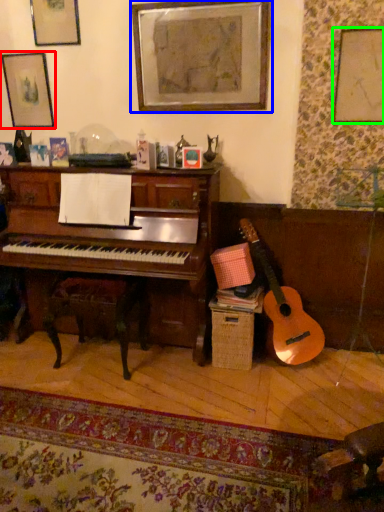
Question: Based on their relative distances, which object is nearer to picture frame (highlighted by a red box)? Choose from picture frame (highlighted by a blue box) and picture frame (highlighted by a green box).

Choices:
 (A) picture frame
 (B) picture frame

Answer: (A)